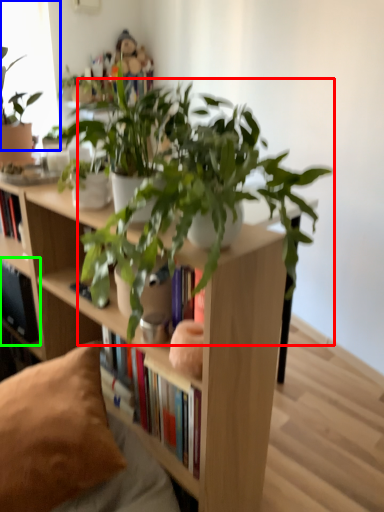
Question: Based on their relative distances, which object is nearer to houseplant (highlighted by a red box)? Choose from window screen (highlighted by a blue box) and shelf (highlighted by a green box).

Choices:
 (A) window screen
 (B) shelf

Answer: (B)